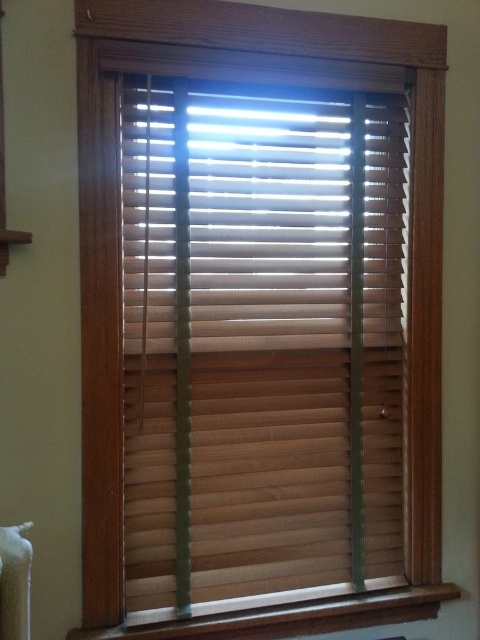
Does wooden blinds at center have a larger size compared to wooden at lower center?

Yes.

Is point (154, 284) closer to viewer compared to point (350, 618)?

Yes, point (154, 284) is closer to viewer.

Identify the location of wooden blinds at center. (261, 342).